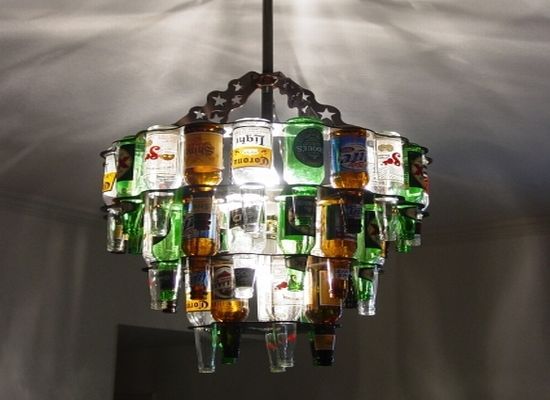
At what (x,y) coordinates should I click in order to perform the action: click on bar from ceiling. Please return your answer as a coordinate pair (x, y). This screenshot has width=550, height=400. Looking at the image, I should click on (267, 36).